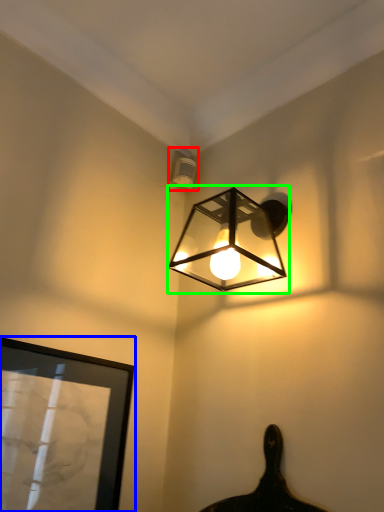
Question: Which object is the closest to the lamp (highlighted by a red box)? Choose among these: picture frame (highlighted by a blue box) or lamp (highlighted by a green box).

Choices:
 (A) picture frame
 (B) lamp

Answer: (B)